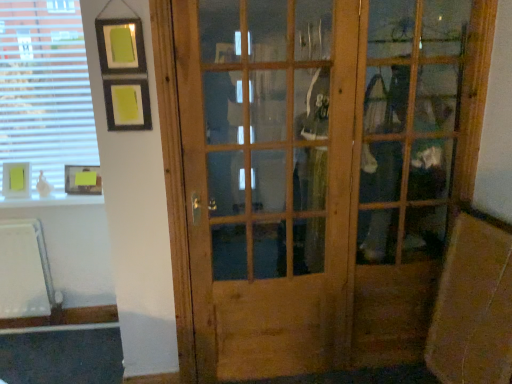
Question: Is wooden door at center outside of yellow paper at lower left, the 1th picture frame in the right-to-left sequence?

Choices:
 (A) no
 (B) yes

Answer: (B)

Question: Can yellow paper at lower left, the 1th picture frame in the right-to-left sequence, be found inside wooden door at center?

Choices:
 (A) no
 (B) yes

Answer: (A)

Question: From the image's perspective, would you say wooden door at center is shown under yellow paper at lower left, the 1th picture frame in the right-to-left sequence?

Choices:
 (A) no
 (B) yes

Answer: (B)

Question: Is wooden door at center positioned with its back to yellow paper at lower left, the second picture frame positioned from the left?

Choices:
 (A) yes
 (B) no

Answer: (B)

Question: Is wooden door at center facing towards yellow paper at lower left, the second picture frame positioned from the left?

Choices:
 (A) yes
 (B) no

Answer: (B)

Question: Considering the relative positions of wooden door at center and yellow paper at lower left, the 1th picture frame in the right-to-left sequence, in the image provided, is wooden door at center in front of yellow paper at lower left, the 1th picture frame in the right-to-left sequence,?

Choices:
 (A) yes
 (B) no

Answer: (A)

Question: From a real-world perspective, does wooden door at center stand above white blinds at upper left?

Choices:
 (A) no
 (B) yes

Answer: (A)

Question: Would you say white blinds at upper left is part of wooden door at center's contents?

Choices:
 (A) yes
 (B) no

Answer: (B)

Question: Is wooden door at center next to white blinds at upper left?

Choices:
 (A) yes
 (B) no

Answer: (B)

Question: Is wooden door at center smaller than white blinds at upper left?

Choices:
 (A) no
 (B) yes

Answer: (A)

Question: Is wooden door at center not inside white blinds at upper left?

Choices:
 (A) no
 (B) yes

Answer: (B)

Question: Considering the relative sizes of wooden door at center and white blinds at upper left in the image provided, is wooden door at center wider than white blinds at upper left?

Choices:
 (A) no
 (B) yes

Answer: (B)

Question: From a real-world perspective, is matte yellow picture frame at upper left, placed as the second picture frame when sorted from right to left, located beneath wooden door at center?

Choices:
 (A) no
 (B) yes

Answer: (A)